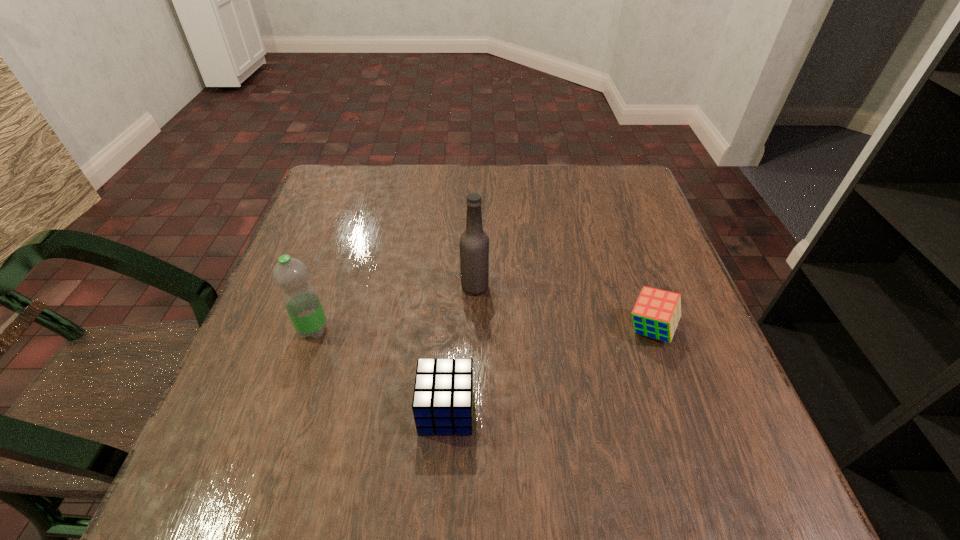
Locate which object is the second closest to the third shortest object. Please provide its 2D coordinates. Your answer should be formatted as a tuple, i.e. [(x, y)], where the tuple contains the x and y coordinates of a point satisfying the conditions above.

[(474, 242)]

The width and height of the screenshot is (960, 540). Identify the location of object that ranks as the closest to the beer bottle. pyautogui.click(x=442, y=404).

Where is `vacant space that satisfies the following two spatial constraints: 1. on the side of the tallest object with the label; 2. on the back side of the farther cube`? This screenshot has height=540, width=960. vacant space that satisfies the following two spatial constraints: 1. on the side of the tallest object with the label; 2. on the back side of the farther cube is located at coordinates (474, 330).

Locate an element on the screen. This screenshot has width=960, height=540. vacant position in the image that satisfies the following two spatial constraints: 1. on the back side of the rightmost object; 2. on the side of the beer bottle with the label is located at coordinates (636, 287).

Locate an element on the screen. The image size is (960, 540). blank space that satisfies the following two spatial constraints: 1. on the back side of the right cube; 2. on the left side of the nearest object is located at coordinates (451, 330).